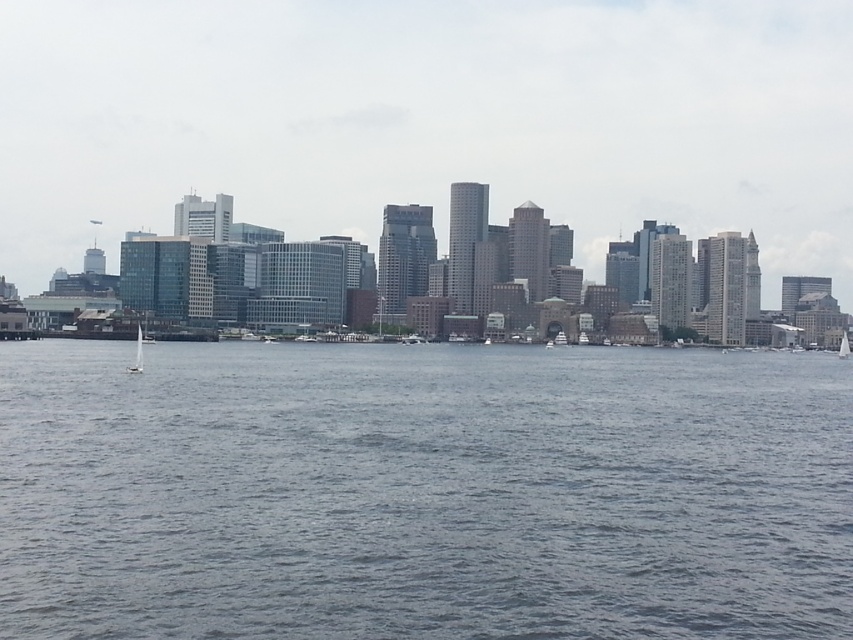
Between point (358, 145) and point (840, 339), which one is positioned in front?

Point (840, 339) is more forward.

Does point (637, 65) come behind point (840, 352)?

Yes, it is.

The height and width of the screenshot is (640, 853). Identify the location of transparent glass skyscrapers at center. (428, 120).

Who is more forward, (641, 65) or (129, 371)?

Positioned in front is point (129, 371).

Can you confirm if transparent glass skyscrapers at center is shorter than white glossy sailboat at lower left?

Incorrect, transparent glass skyscrapers at center's height does not fall short of white glossy sailboat at lower left's.

Image resolution: width=853 pixels, height=640 pixels. I want to click on transparent glass skyscrapers at center, so click(x=428, y=120).

Between gray water at center and white sailboat at right, which one has more height?

Standing taller between the two is white sailboat at right.

Can you confirm if gray water at center is taller than white sailboat at right?

No.

Does point (120, 390) lie in front of point (839, 353)?

Yes, it is.

Locate an element on the screen. Image resolution: width=853 pixels, height=640 pixels. gray water at center is located at coordinates (422, 492).